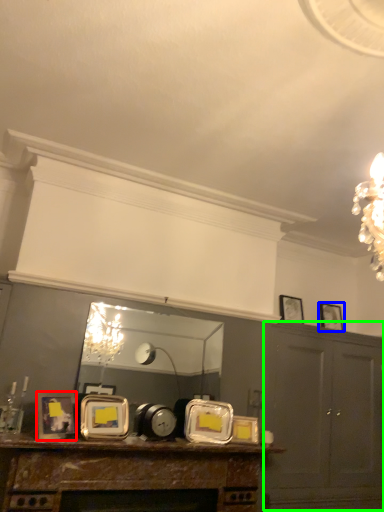
Question: Based on their relative distances, which object is nearer to picture frame (highlighted by a red box)? Choose from picture frame (highlighted by a blue box) and cabinetry (highlighted by a green box).

Choices:
 (A) picture frame
 (B) cabinetry

Answer: (B)